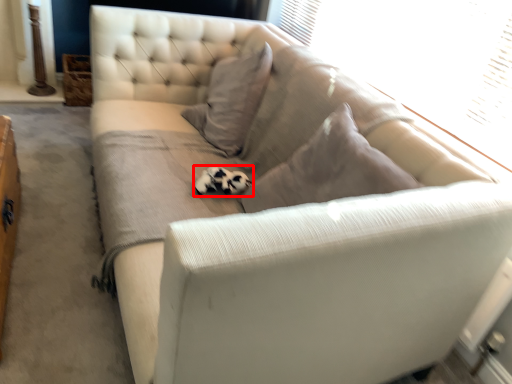
Question: From the image's perspective, what is the correct spatial positioning of animal (annotated by the red box) in reference to window screen?

Choices:
 (A) above
 (B) below

Answer: (B)